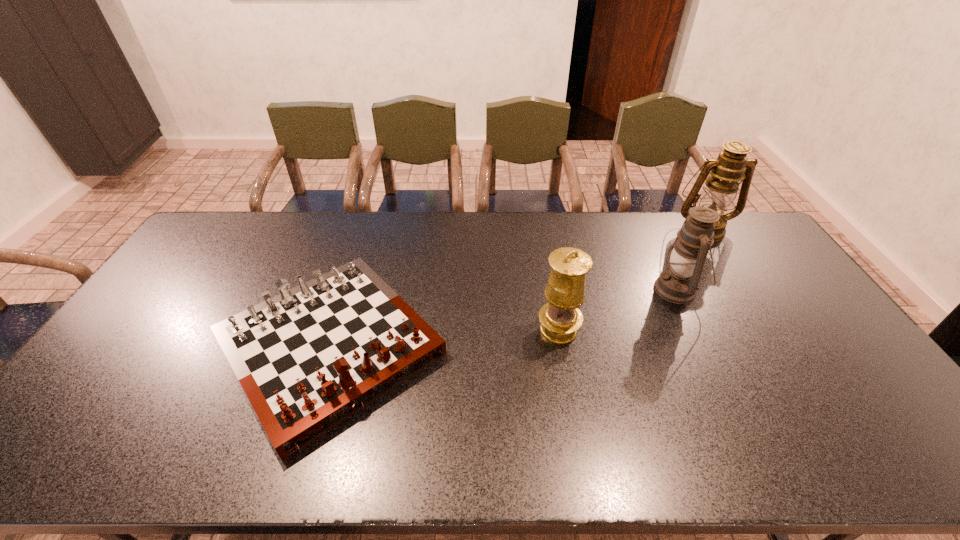
You are a GUI agent. You are given a task and a screenshot of the screen. Output one action in this format:
    pyautogui.click(x=<x>, y=<y>)
    Task: Click on the vacant space that is in between the leftmost oil lamp and the farthest oil lamp
    Image resolution: width=960 pixels, height=540 pixels.
    Given the screenshot: What is the action you would take?
    pyautogui.click(x=631, y=279)

You are a GUI agent. You are given a task and a screenshot of the screen. Output one action in this format:
    pyautogui.click(x=<x>, y=<y>)
    Task: Click on the vacant area that lies between the gameboard and the second oil lamp from right to left
    
    Given the screenshot: What is the action you would take?
    pyautogui.click(x=504, y=318)

This screenshot has height=540, width=960. Identify the location of vacant point located between the second object from right to left and the gameboard. (504, 318).

The height and width of the screenshot is (540, 960). Identify the location of unoccupied position between the nearest oil lamp and the farthest object. (631, 279).

Where is `vacant space that's between the leftmost object and the rightmost object`? The width and height of the screenshot is (960, 540). vacant space that's between the leftmost object and the rightmost object is located at coordinates (516, 287).

Where is `free point between the second object from right to left and the third object from right to left`? The image size is (960, 540). free point between the second object from right to left and the third object from right to left is located at coordinates 618,310.

You are a GUI agent. You are given a task and a screenshot of the screen. Output one action in this format:
    pyautogui.click(x=<x>, y=<y>)
    Task: Click on the empty location between the second farthest oil lamp and the shortest object
    This screenshot has height=540, width=960.
    Given the screenshot: What is the action you would take?
    [504, 318]

Identify the location of free point between the rightmost oil lamp and the shortest object. (516, 287).

The image size is (960, 540). Find the location of `the third closest object relative to the second object from left to right`. the third closest object relative to the second object from left to right is located at coordinates (732, 165).

Select which object appears as the second closest to the leftmost object. Please provide its 2D coordinates. Your answer should be formatted as a tuple, i.e. [(x, y)], where the tuple contains the x and y coordinates of a point satisfying the conditions above.

[(679, 284)]